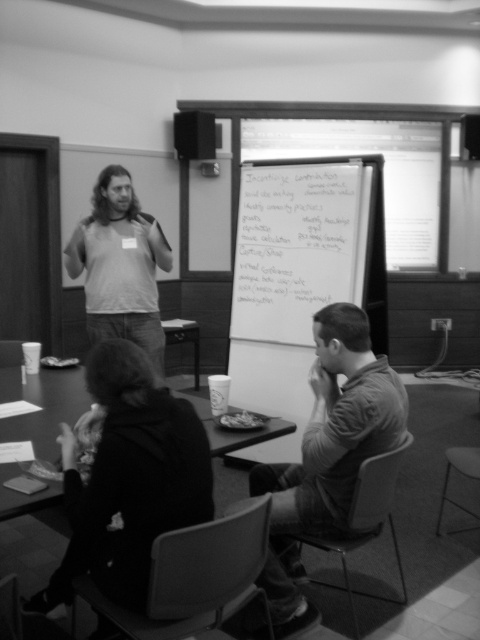
Question: Which point appears farthest from the camera in this image?

Choices:
 (A) (200, 124)
 (B) (100, 176)
 (C) (132, 588)
 (D) (350, 392)

Answer: (A)

Question: Which object is closer to the camera taking this photo?

Choices:
 (A) matte gray shirt at center
 (B) white paper at center
 (C) matte black speaker at upper center

Answer: (A)

Question: Which is nearer to the white paper at center?

Choices:
 (A) matte gray tank top at center
 (B) smooth plastic table at lower center
 (C) dark fabric jacket at lower left
 (D) matte gray shirt at center

Answer: (A)

Question: Does white paper at center appear on the left side of matte gray tank top at center?

Choices:
 (A) no
 (B) yes

Answer: (A)

Question: Is dark fabric jacket at lower left wider than white paper at center?

Choices:
 (A) yes
 (B) no

Answer: (B)

Question: Is white paper at center above matte gray tank top at center?

Choices:
 (A) no
 (B) yes

Answer: (B)